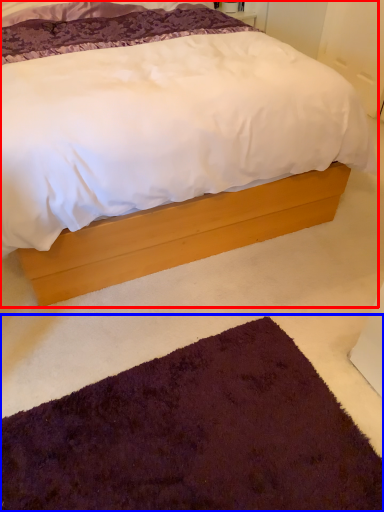
Question: Among these objects, which one is nearest to the camera, bed (highlighted by a red box) or doormat (highlighted by a blue box)?

Choices:
 (A) bed
 (B) doormat

Answer: (A)